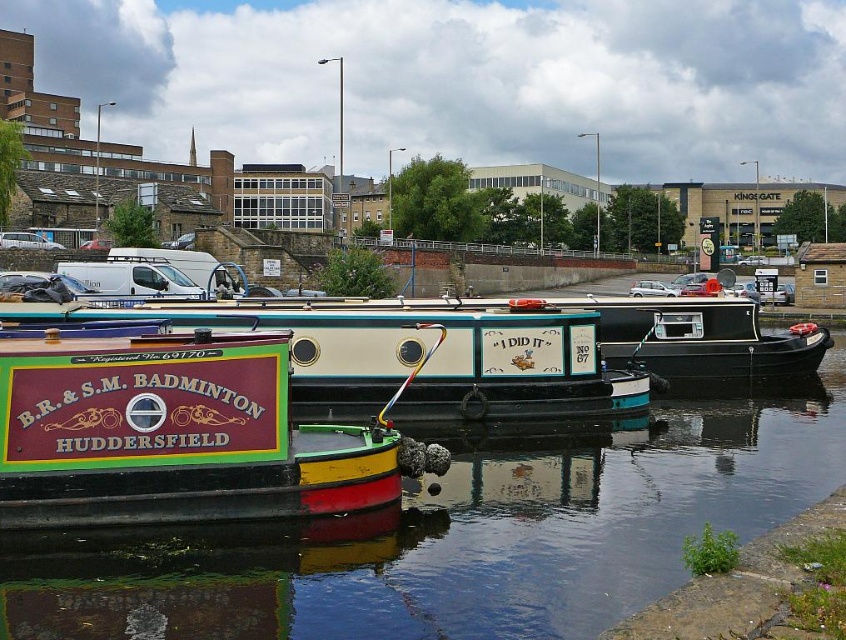
Question: Which object appears closest to the camera in this image?

Choices:
 (A) maroon painted wood boat at lower left
 (B) smooth black water at center

Answer: (B)

Question: Does smooth black water at center come in front of maroon painted wood boat at lower left?

Choices:
 (A) yes
 (B) no

Answer: (A)

Question: Does smooth black water at center have a greater width compared to maroon painted wood boat at center?

Choices:
 (A) yes
 (B) no

Answer: (A)

Question: Which of the following is the farthest from the observer?

Choices:
 (A) smooth black water at center
 (B) maroon painted wood boat at lower left

Answer: (B)

Question: Is maroon painted wood boat at lower left thinner than maroon painted wood boat at center?

Choices:
 (A) yes
 (B) no

Answer: (B)

Question: Estimate the real-world distances between objects in this image. Which object is closer to the maroon painted wood boat at lower left?

Choices:
 (A) maroon painted wood boat at center
 (B) smooth black water at center

Answer: (B)